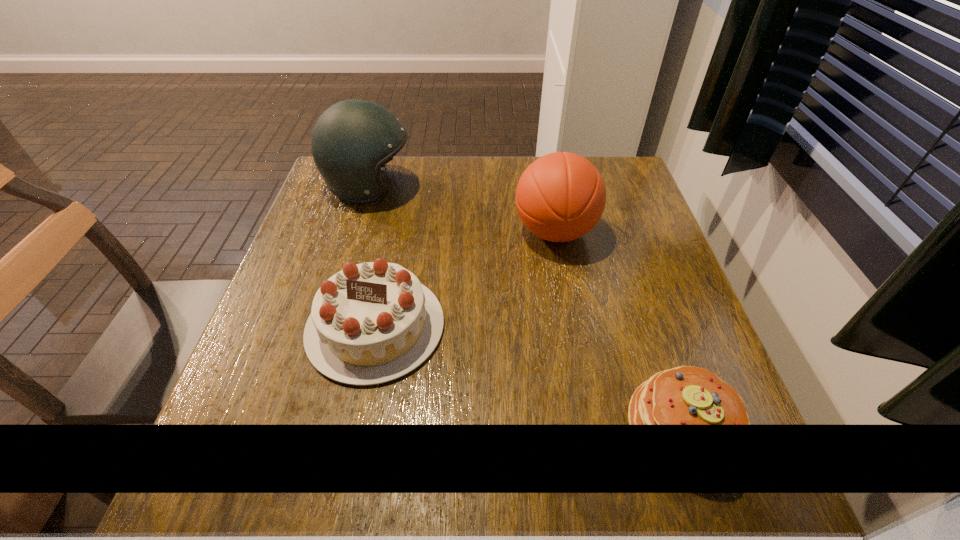
The width and height of the screenshot is (960, 540). Identify the location of vacant point located between the shortest object and the birthday cake. (530, 377).

Identify the location of free area in between the football helmet and the pancake. The image size is (960, 540). (527, 307).

Locate an element on the screen. The image size is (960, 540). unoccupied area between the football helmet and the second shortest object is located at coordinates (372, 257).

Locate an element on the screen. The image size is (960, 540). unoccupied area between the pancake and the football helmet is located at coordinates (527, 307).

Select which object appears as the closest to the birthday cake. Please provide its 2D coordinates. Your answer should be formatted as a tuple, i.e. [(x, y)], where the tuple contains the x and y coordinates of a point satisfying the conditions above.

[(561, 196)]

Select which object is the closest to the second tallest object. Please provide its 2D coordinates. Your answer should be formatted as a tuple, i.e. [(x, y)], where the tuple contains the x and y coordinates of a point satisfying the conditions above.

[(370, 323)]

You are a GUI agent. You are given a task and a screenshot of the screen. Output one action in this format:
    pyautogui.click(x=<x>, y=<y>)
    Task: Click on the free spot that satisfies the following two spatial constraints: 1. at the face opening of the birthday cake; 2. on the left side of the football helmet
    The width and height of the screenshot is (960, 540).
    Given the screenshot: What is the action you would take?
    pyautogui.click(x=327, y=327)

At what (x,y) coordinates should I click in order to perform the action: click on vacant space that satisfies the following two spatial constraints: 1. on the back side of the third shortest object; 2. at the face opening of the football helmet. Please return your answer as a coordinate pair (x, y). Looking at the image, I should click on (546, 187).

Find the location of a particular element. vacant space that satisfies the following two spatial constraints: 1. at the face opening of the second shortest object; 2. on the right side of the football helmet is located at coordinates (327, 327).

The height and width of the screenshot is (540, 960). I want to click on vacant area that satisfies the following two spatial constraints: 1. at the face opening of the football helmet; 2. on the left side of the pancake, so click(297, 428).